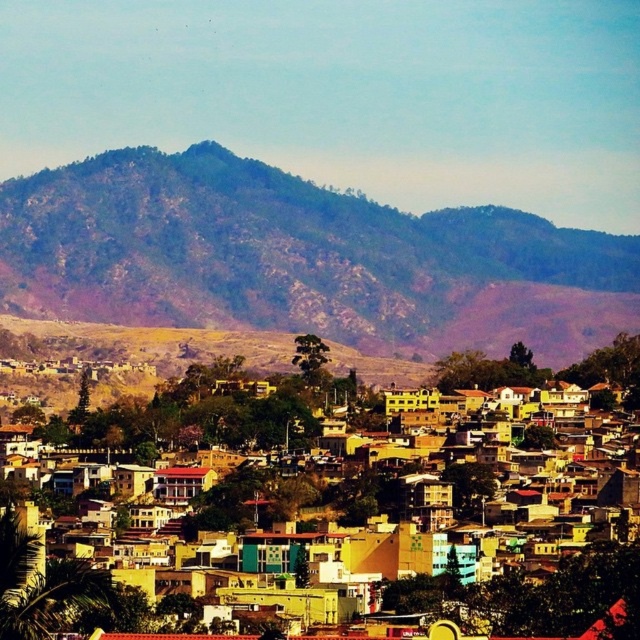
Question: Which of the following is the farthest from the observer?

Choices:
 (A) (576, 628)
 (B) (188, 316)

Answer: (A)

Question: Is brown rocky mountain at upper center smaller than yellow matte buildings at center?

Choices:
 (A) no
 (B) yes

Answer: (A)

Question: Can you confirm if brown rocky mountain at upper center is bigger than yellow matte buildings at center?

Choices:
 (A) no
 (B) yes

Answer: (B)

Question: Can you confirm if brown rocky mountain at upper center is bigger than yellow matte buildings at center?

Choices:
 (A) yes
 (B) no

Answer: (A)

Question: Which point is closer to the camera?

Choices:
 (A) brown rocky mountain at upper center
 (B) yellow matte buildings at center

Answer: (A)